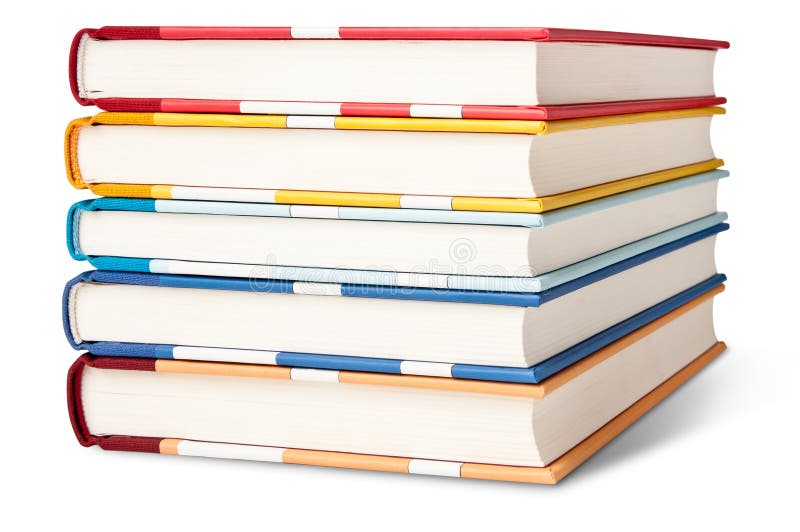
At what (x,y) coordinates should I click in order to perform the action: click on books. Please return your answer as a coordinate pair (x, y). Looking at the image, I should click on (337, 78), (342, 145), (353, 232), (344, 313), (342, 401).